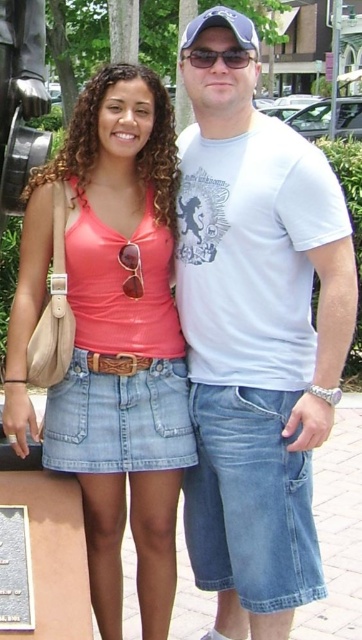
Question: Is white cotton t-shirt at center further to camera compared to matte coral tank top at center?

Choices:
 (A) no
 (B) yes

Answer: (A)

Question: Among these objects, which one is farthest from the camera?

Choices:
 (A) white cotton t-shirt at center
 (B) matte coral tank top at center

Answer: (B)

Question: Is white cotton t-shirt at center thinner than matte coral tank top at center?

Choices:
 (A) no
 (B) yes

Answer: (B)

Question: Is white cotton t-shirt at center closer to the viewer compared to matte coral tank top at center?

Choices:
 (A) yes
 (B) no

Answer: (A)